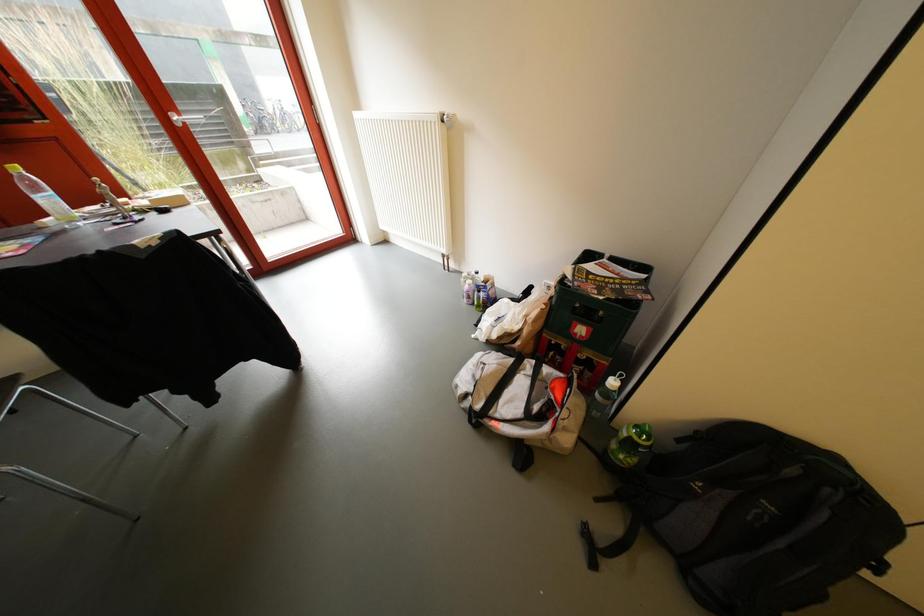
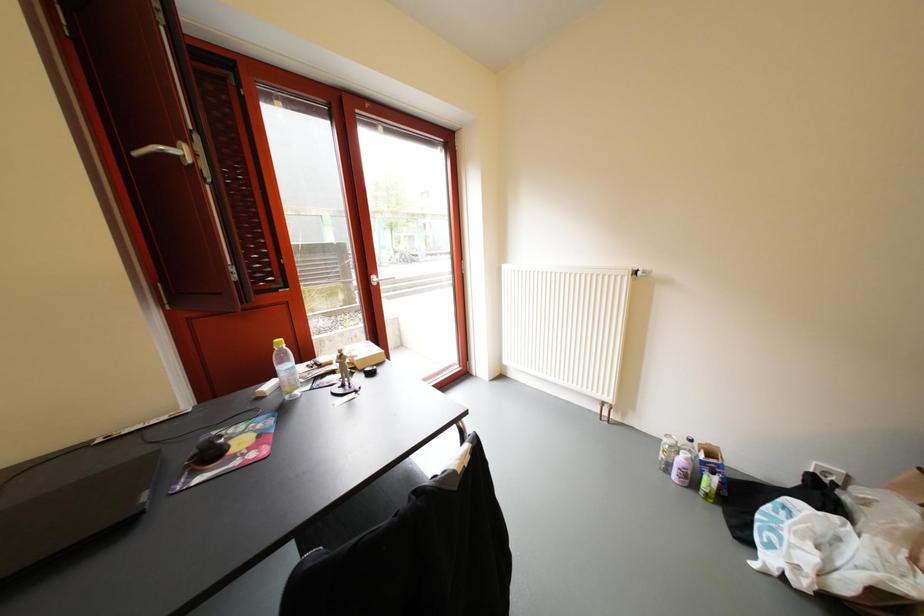
Question: In a continuous first-person perspective shot, in which direction is the camera moving?

Choices:
 (A) Left
 (B) Right
 (C) Forward
 (D) Backward

Answer: (A)